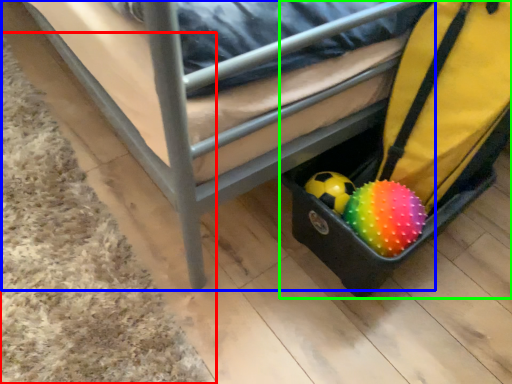
Question: Considering the real-world distances, which object is closest to mat (highlighted by a red box)? furniture (highlighted by a blue box) or luggage (highlighted by a green box).

Choices:
 (A) furniture
 (B) luggage

Answer: (A)